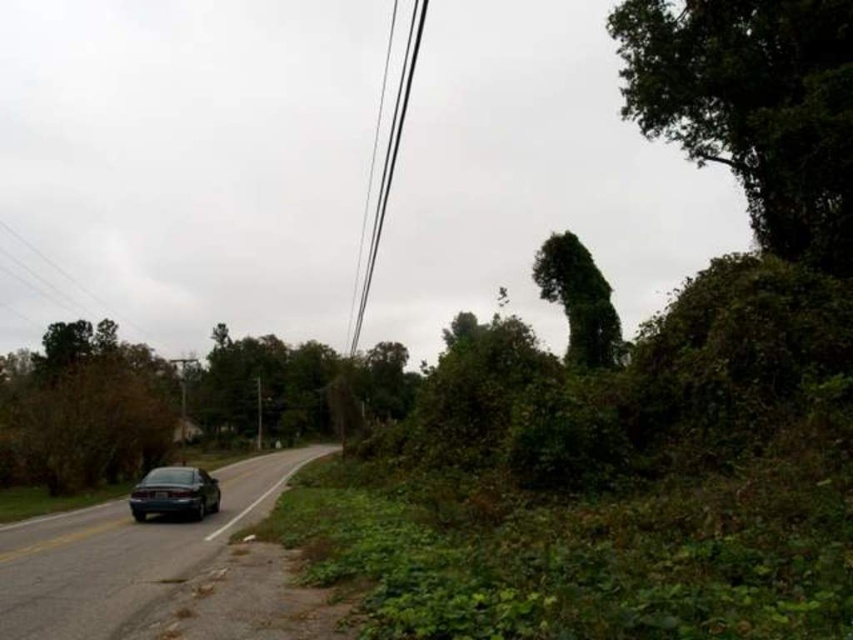
Who is taller, green leafy tree at left or green leafy tree at upper center?

green leafy tree at upper center is taller.

Consider the image. Can you confirm if green leafy tree at left is positioned to the left of green leafy tree at upper center?

Yes, green leafy tree at left is to the left of green leafy tree at upper center.

Image resolution: width=853 pixels, height=640 pixels. Describe the element at coordinates (83, 410) in the screenshot. I see `green leafy tree at left` at that location.

Find the location of a particular element. This screenshot has width=853, height=640. green leafy tree at left is located at coordinates (83, 410).

Which is below, green leafy tree at left or black wire at upper center?

green leafy tree at left

The width and height of the screenshot is (853, 640). I want to click on green leafy tree at left, so click(x=83, y=410).

Does green leafy tree at upper right appear over green leafy tree at left?

Yes.

Between point (772, 36) and point (115, 461), which one is positioned behind?

Point (115, 461)

You are a GUI agent. You are given a task and a screenshot of the screen. Output one action in this format:
    pyautogui.click(x=<x>, y=<y>)
    Task: Click on the green leafy tree at upper right
    The image size is (853, 640).
    Given the screenshot: What is the action you would take?
    pyautogui.click(x=753, y=106)